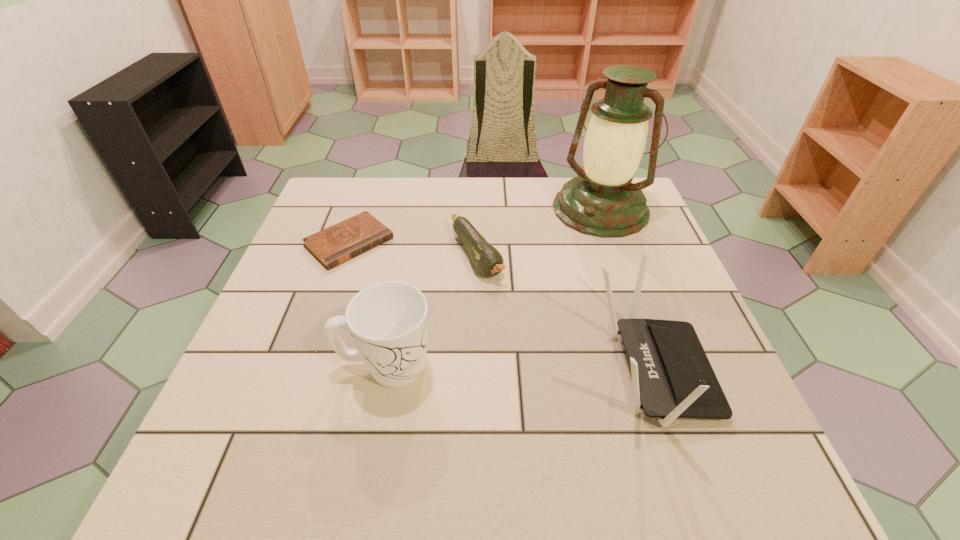
You are a GUI agent. You are given a task and a screenshot of the screen. Output one action in this format:
    pyautogui.click(x=<x>, y=<y>)
    Task: Click on the object present at the left edge
    The image size is (960, 540).
    Given the screenshot: What is the action you would take?
    pyautogui.click(x=332, y=246)

Find the location of a particular element. The width and height of the screenshot is (960, 540). router located at the right edge is located at coordinates click(671, 375).

Where is `lantern present at the right edge`? The width and height of the screenshot is (960, 540). lantern present at the right edge is located at coordinates (602, 202).

Identify the location of object that is at the far left corner. The image size is (960, 540). (332, 246).

This screenshot has height=540, width=960. I want to click on object that is at the far right corner, so click(x=602, y=202).

Image resolution: width=960 pixels, height=540 pixels. What are the coordinates of `object that is at the near right corner` in the screenshot? It's located at (671, 375).

At what (x,y) coordinates should I click in order to perform the action: click on blank space at the far edge of the desktop. Please return your answer as a coordinate pair (x, y). This screenshot has height=540, width=960. Looking at the image, I should click on (535, 185).

In the image, there is a desktop. Find the location of `blank space at the near edge`. blank space at the near edge is located at coordinates (340, 406).

This screenshot has height=540, width=960. In the image, there is a desktop. Find the location of `vacant space at the left edge`. vacant space at the left edge is located at coordinates (303, 356).

In the image, there is a desktop. Where is `vacant space at the right edge`? Image resolution: width=960 pixels, height=540 pixels. vacant space at the right edge is located at coordinates (614, 244).